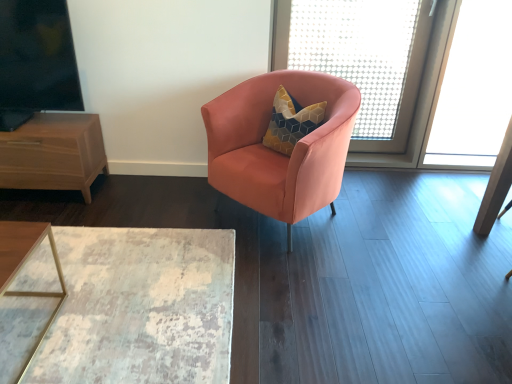
Where is `vacant area that is in front of satin peach armchair at center`? The height and width of the screenshot is (384, 512). vacant area that is in front of satin peach armchair at center is located at coordinates (315, 280).